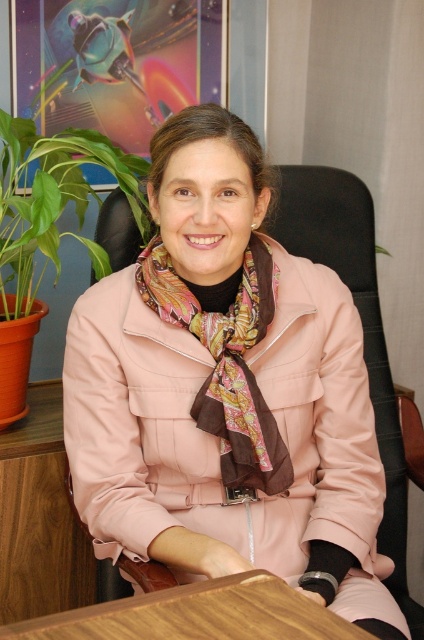
Is the position of multicolored silk scarf at center more distant than that of green leafy plant at left?

No, it is not.

Who is more distant from viewer, (237, 289) or (30, 205)?

The point (30, 205) is behind.

This screenshot has width=424, height=640. I want to click on multicolored silk scarf at center, so [x=226, y=364].

Is green leafy plant at left bigger than wooden at center?

Yes, green leafy plant at left is bigger than wooden at center.

Between green leafy plant at left and wooden at center, which one appears on the left side from the viewer's perspective?

Positioned to the left is green leafy plant at left.

Locate an element on the screen. This screenshot has height=640, width=424. green leafy plant at left is located at coordinates point(53,198).

In the scene shown: Is pink fabric coat at center to the left of green leafy plant at left from the viewer's perspective?

In fact, pink fabric coat at center is to the right of green leafy plant at left.

Who is more distant from viewer, (278,490) or (58,186)?

Positioned behind is point (58,186).

Find the location of a particular element. pink fabric coat at center is located at coordinates pyautogui.click(x=226, y=392).

At what (x,y) coordinates should I click in order to perform the action: click on pink fabric coat at center. Please return your answer as a coordinate pair (x, y). Looking at the image, I should click on (226, 392).